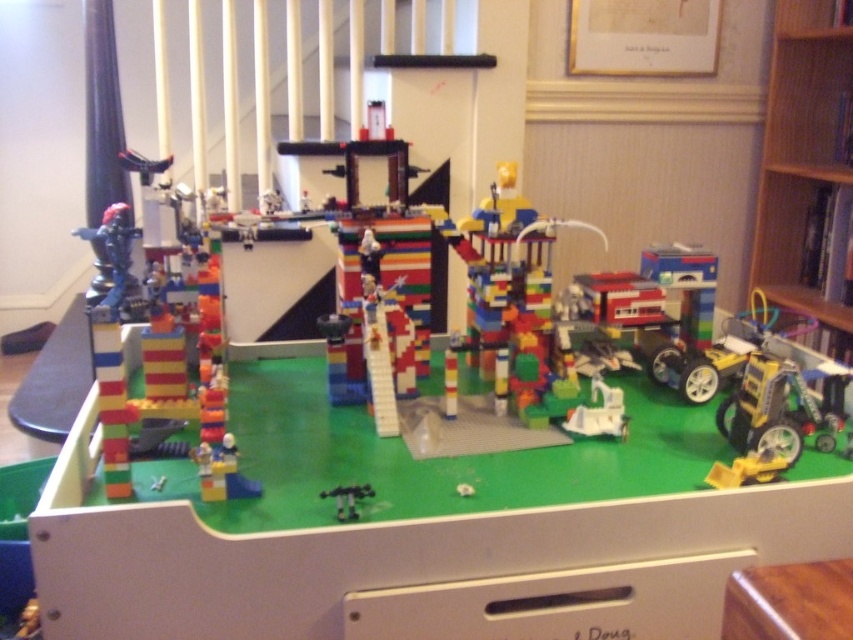
You are organizing a child safety inspection in the room where the wooden bookshelf at right and the black plastic toy at center are located. Based on their sizes, which object is more likely to be a choking hazard for a toddler?

The black plastic toy at center is more likely to be a choking hazard for a toddler since it is smaller in size compared to the wooden bookshelf at right.

You are a delivery robot with a 1 meter long package. You need to move from the wooden bookshelf at right to the black plastic toy at center. Can you carry the package horizontally without tilting it?

The distance between the wooden bookshelf at right and the black plastic toy at center is 1.96 meters. Since the package is 1 meter long, you can carry it horizontally without tilting as there is enough space.